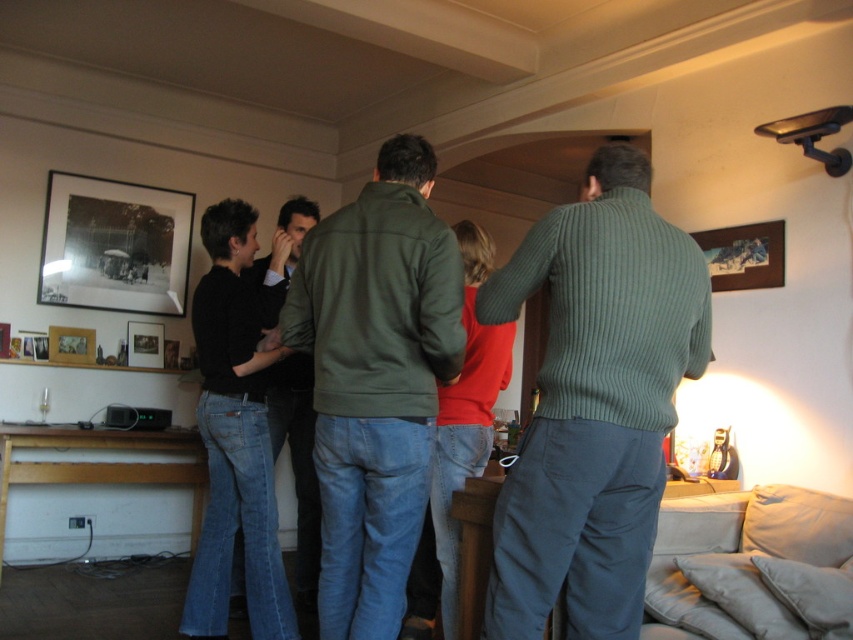
Question: Which is nearer to the ribbed green sweater at center?

Choices:
 (A) matte green jacket at center
 (B) wooden framed picture at upper right
 (C) dark green sweater at center

Answer: (A)

Question: Among these points, which one is nearest to the camera?

Choices:
 (A) (57, 342)
 (B) (749, 244)
 (C) (112, 216)

Answer: (B)

Question: Is ribbed green sweater at center above matte black picture frame at upper left?

Choices:
 (A) yes
 (B) no

Answer: (B)

Question: Is ribbed green sweater at center to the right of wooden framed picture at upper right from the viewer's perspective?

Choices:
 (A) yes
 (B) no

Answer: (B)

Question: Considering the real-world distances, which object is farthest from the matte black picture frame at upper left?

Choices:
 (A) matte black picture frame at left
 (B) wooden picture frame at center
 (C) ribbed green sweater at center

Answer: (C)

Question: Where is black matte picture frame at upper left located in relation to dark green sweater at center in the image?

Choices:
 (A) right
 (B) left

Answer: (B)